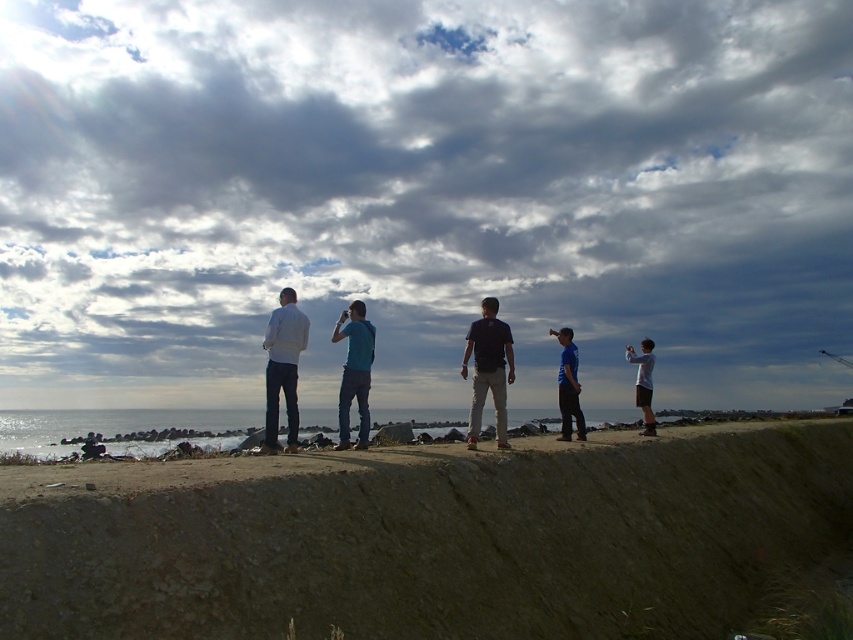
Who is lower down, teal matte shirt at center or blue fabric shirt at center?

blue fabric shirt at center is below.

Which of these two, teal matte shirt at center or blue fabric shirt at center, stands shorter?

teal matte shirt at center

You are a GUI agent. You are given a task and a screenshot of the screen. Output one action in this format:
    pyautogui.click(x=<x>, y=<y>)
    Task: Click on the teal matte shirt at center
    The height and width of the screenshot is (640, 853).
    Given the screenshot: What is the action you would take?
    [354, 371]

Locate an element on the screen. This screenshot has height=640, width=853. teal matte shirt at center is located at coordinates (354, 371).

What do you see at coordinates (427, 538) in the screenshot? I see `smooth concrete cliff at lower center` at bounding box center [427, 538].

Who is lower down, smooth concrete cliff at lower center or teal matte shirt at center?

Positioned lower is smooth concrete cliff at lower center.

Is point (463, 522) farther from camera compared to point (366, 348)?

That is False.

Find the location of a particular element. This screenshot has width=853, height=640. smooth concrete cliff at lower center is located at coordinates (427, 538).

Does white matte jacket at center lie behind blue fabric shirt at center?

No.

Does point (306, 326) come closer to viewer compared to point (570, 342)?

Yes, point (306, 326) is closer to viewer.

Identify the location of white matte jacket at center. This screenshot has height=640, width=853. (x=282, y=369).